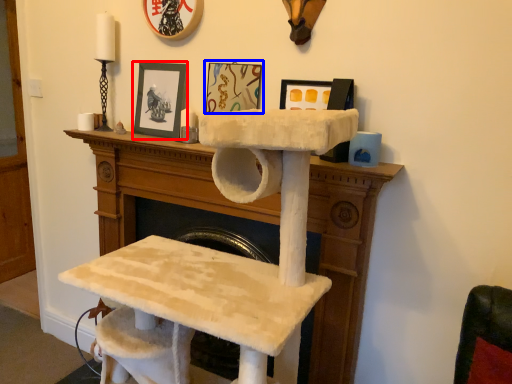
Question: Which object is closer to the camera taking this photo, picture frame (highlighted by a red box) or picture frame (highlighted by a blue box)?

Choices:
 (A) picture frame
 (B) picture frame

Answer: (B)